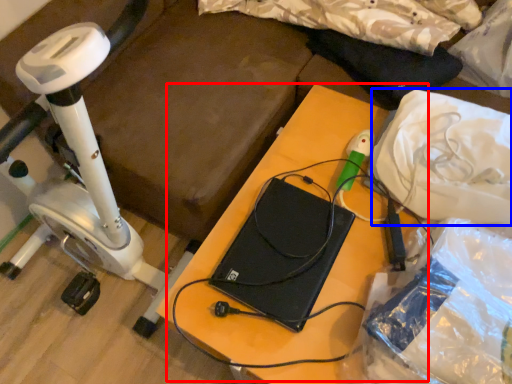
Question: Which of the following is the farthest to the observer, table (highlighted by a red box) or material (highlighted by a blue box)?

Choices:
 (A) table
 (B) material

Answer: (B)